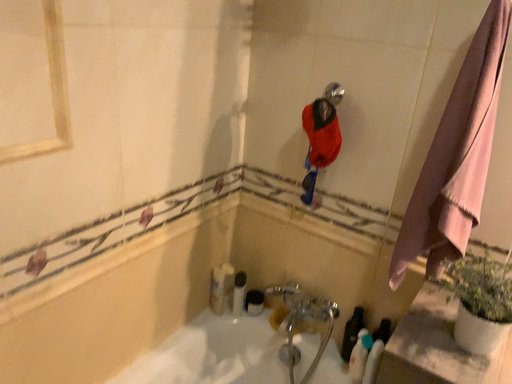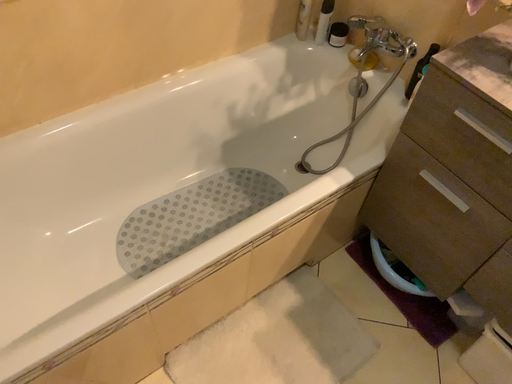
Question: How did the camera likely rotate when shooting the video?

Choices:
 (A) rotated left
 (B) rotated right

Answer: (A)